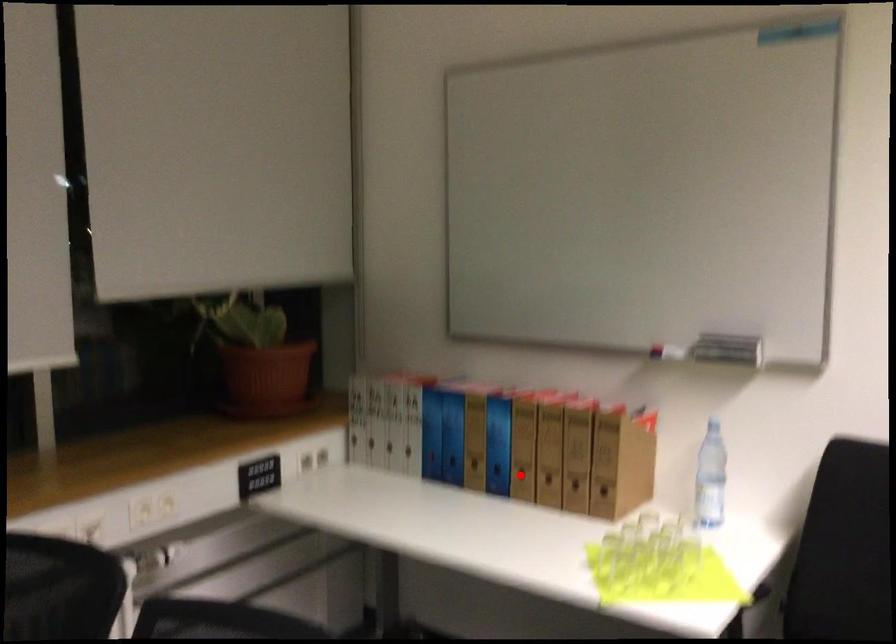
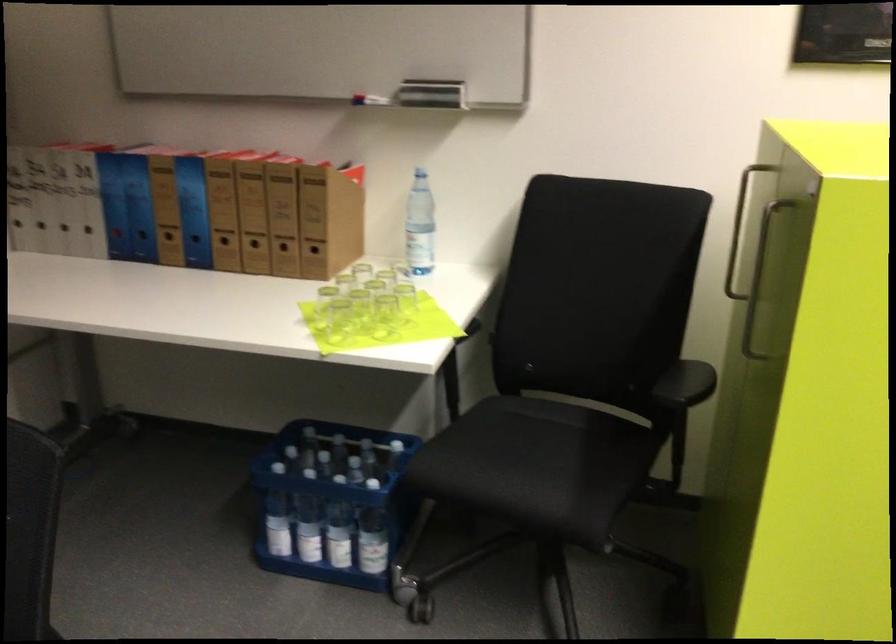
Where in the second image is the point corresponding to the highlighted location from the first image?

(225, 245)